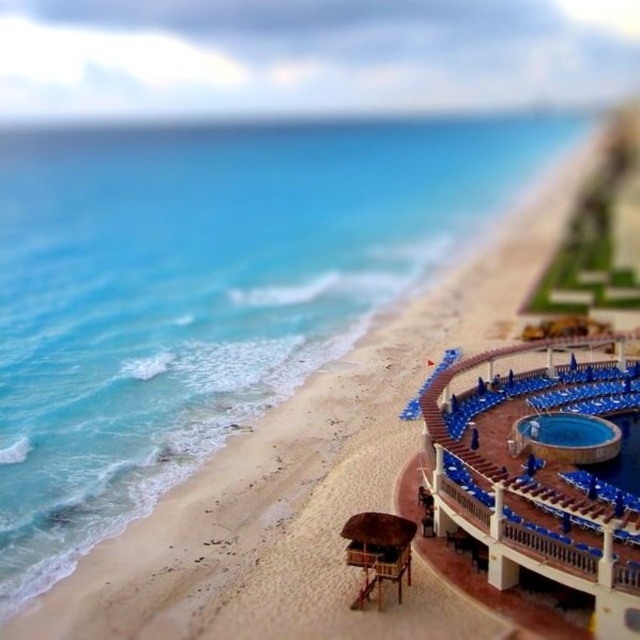
You are standing at the resort walkway and want to locate two specific points on the beach. The first point is at coordinates point (548,422) and the second is at point (612,468). Which of these two points is closer to you?

Point (548,422) is closer to you because it is further to the viewer than point (612,468).

From the picture: You are standing at the resort walkway and want to take a photo of both the point at coordinates point (x=620, y=586) and point (x=624, y=483). Which point will appear larger in your photo?

Point (x=620, y=586) is closer to the camera than point (x=624, y=483), so it will appear larger in the photo.

You are a guest staying at the coastal resort and want to relax in the blue plastic lounge chairs at lower right. However, you notice the blue glossy pool at lower right is nearby. Is the lounge chairs area over the pool or on the beach?

The blue plastic lounge chairs at lower right are positioned over the blue glossy pool at lower right, so the lounge chairs are located over the pool rather than on the beach.